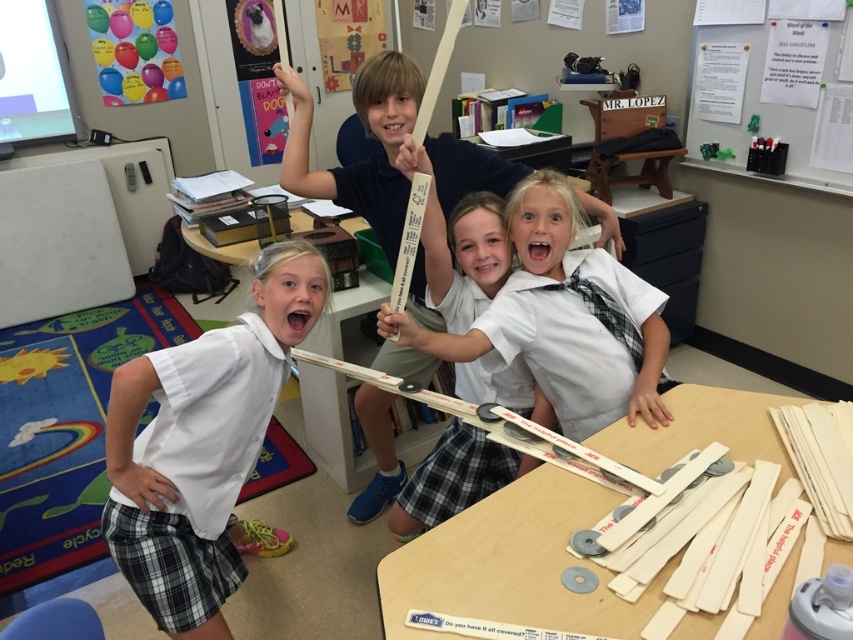
Question: Which object is the farthest from the white glossy shirt at center?

Choices:
 (A) white cardboard strips at center
 (B) white glossy tie at center

Answer: (A)

Question: Which of the following is the closest to the observer?

Choices:
 (A) (285, 536)
 (B) (418, 636)

Answer: (B)

Question: Which object is positioned closest to the white glossy tie at center?

Choices:
 (A) white glossy shirt at center
 (B) white cardboard strips at center

Answer: (B)

Question: Considering the relative positions of white glossy shirt at center and white cardboard strips at center in the image provided, where is white glossy shirt at center located with respect to white cardboard strips at center?

Choices:
 (A) right
 (B) left

Answer: (B)

Question: Is white cardboard strips at center wider than white glossy tie at center?

Choices:
 (A) no
 (B) yes

Answer: (B)

Question: From the image, what is the correct spatial relationship of white glossy shirt at center in relation to white glossy tie at center?

Choices:
 (A) left
 (B) right

Answer: (A)